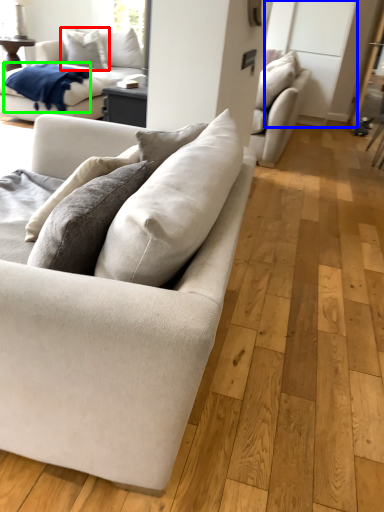
Question: Considering the real-world distances, which object is farthest from pillow (highlighted by a red box)? glass door (highlighted by a blue box) or blanket (highlighted by a green box)?

Choices:
 (A) glass door
 (B) blanket

Answer: (A)